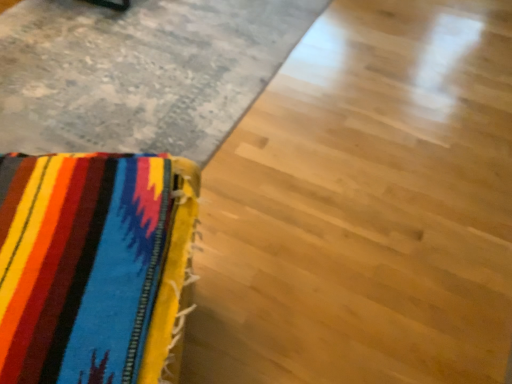
What do you see at coordinates (92, 265) in the screenshot?
I see `textured wool blanket at lower left` at bounding box center [92, 265].

The height and width of the screenshot is (384, 512). I want to click on textured wool blanket at lower left, so (x=92, y=265).

Find the location of a particular element. The width and height of the screenshot is (512, 384). textured wool blanket at lower left is located at coordinates (92, 265).